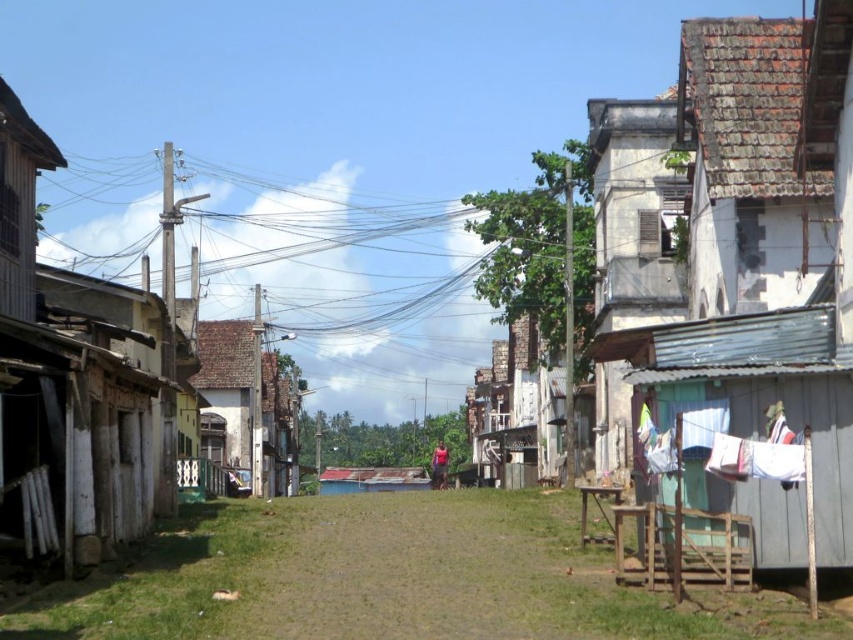
Is wooden hut at left positioned in front of white wooden hut at center?

Yes, it is.

This screenshot has width=853, height=640. Find the location of `wooden hut at left`. wooden hut at left is located at coordinates (74, 381).

Which is in front, point (10, 180) or point (495, 474)?

Point (10, 180)

The height and width of the screenshot is (640, 853). Identify the location of wooden hut at left. (74, 381).

Does rusty corrugated metal hut at right have a larger size compared to white wooden hut at center?

No, rusty corrugated metal hut at right is not bigger than white wooden hut at center.

Is rusty corrugated metal hut at right below white wooden hut at center?

No, rusty corrugated metal hut at right is not below white wooden hut at center.

Describe the element at coordinates (738, 244) in the screenshot. I see `rusty corrugated metal hut at right` at that location.

At what (x,y) coordinates should I click in order to perform the action: click on rusty corrugated metal hut at right. Please return your answer as a coordinate pair (x, y). The width and height of the screenshot is (853, 640). Looking at the image, I should click on (738, 244).

Does rusty corrugated metal hut at right appear on the right side of wooden hut at left?

Yes, rusty corrugated metal hut at right is to the right of wooden hut at left.

Does rusty corrugated metal hut at right have a larger size compared to wooden hut at left?

Yes.

Does point (778, 227) lie in front of point (165, 323)?

Yes, it is.

Identify the location of rusty corrugated metal hut at right. The image size is (853, 640). pyautogui.click(x=738, y=244).